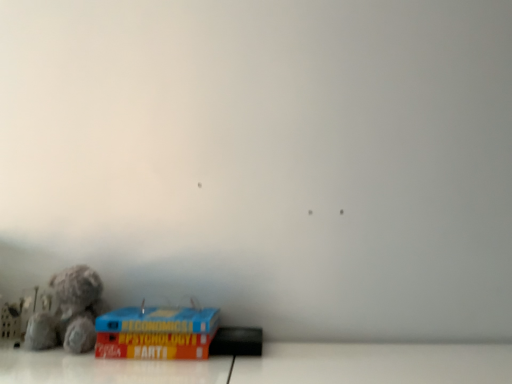
Question: Is blue cardboard box at lower left positioned beyond the bounds of fuzzy fabric teddy bear at lower left?

Choices:
 (A) no
 (B) yes

Answer: (B)

Question: Is blue cardboard box at lower left positioned before fuzzy fabric teddy bear at lower left?

Choices:
 (A) yes
 (B) no

Answer: (A)

Question: Is blue cardboard box at lower left looking in the opposite direction of fuzzy fabric teddy bear at lower left?

Choices:
 (A) no
 (B) yes

Answer: (A)

Question: From the image's perspective, is blue cardboard box at lower left on fuzzy fabric teddy bear at lower left?

Choices:
 (A) yes
 (B) no

Answer: (B)

Question: Considering the relative sizes of blue cardboard box at lower left and fuzzy fabric teddy bear at lower left in the image provided, is blue cardboard box at lower left taller than fuzzy fabric teddy bear at lower left?

Choices:
 (A) no
 (B) yes

Answer: (A)

Question: Is blue cardboard box at lower left further to the viewer compared to fuzzy fabric teddy bear at lower left?

Choices:
 (A) yes
 (B) no

Answer: (B)

Question: Is fuzzy fabric teddy bear at lower left wider than blue cardboard box at lower left?

Choices:
 (A) yes
 (B) no

Answer: (B)

Question: Are fuzzy fabric teddy bear at lower left and blue cardboard box at lower left beside each other?

Choices:
 (A) no
 (B) yes

Answer: (A)

Question: Would you consider fuzzy fabric teddy bear at lower left to be distant from blue cardboard box at lower left?

Choices:
 (A) yes
 (B) no

Answer: (B)

Question: Can you confirm if fuzzy fabric teddy bear at lower left is taller than blue cardboard box at lower left?

Choices:
 (A) no
 (B) yes

Answer: (B)

Question: Is fuzzy fabric teddy bear at lower left thinner than blue cardboard box at lower left?

Choices:
 (A) yes
 (B) no

Answer: (A)

Question: Is fuzzy fabric teddy bear at lower left behind blue cardboard box at lower left?

Choices:
 (A) no
 (B) yes

Answer: (B)

Question: From a real-world perspective, is fuzzy fabric teddy bear at lower left above or below blue cardboard box at lower left?

Choices:
 (A) below
 (B) above

Answer: (B)